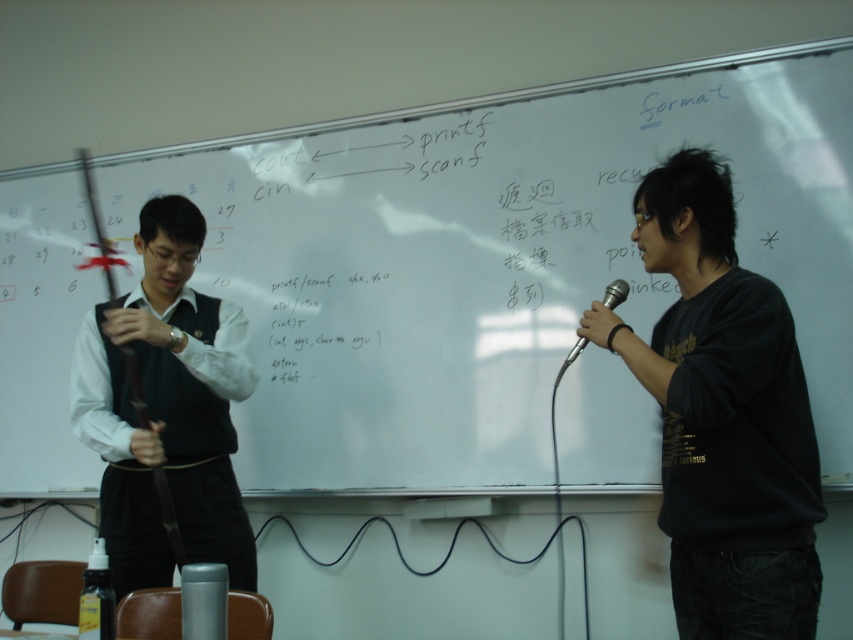
Question: Among these points, which one is nearest to the camera?

Choices:
 (A) tap(721, 600)
 (B) tap(149, 332)
 (C) tap(329, 330)
 (D) tap(614, 285)

Answer: (A)

Question: Can you confirm if whiteboard at center is positioned above black matte shirt at right?

Choices:
 (A) no
 (B) yes

Answer: (B)

Question: Can you confirm if whiteboard at center is positioned below silver metallic microphone at right?

Choices:
 (A) no
 (B) yes

Answer: (A)

Question: Estimate the real-world distances between objects in this image. Which object is closer to the black matte vest at left?

Choices:
 (A) black matte shirt at right
 (B) whiteboard at center
 (C) silver metallic microphone at right

Answer: (B)

Question: Does whiteboard at center have a smaller size compared to silver metallic microphone at right?

Choices:
 (A) yes
 (B) no

Answer: (B)

Question: Among these points, which one is farthest from the camera?

Choices:
 (A) (682, 413)
 (B) (485, 196)
 (C) (561, 369)

Answer: (B)